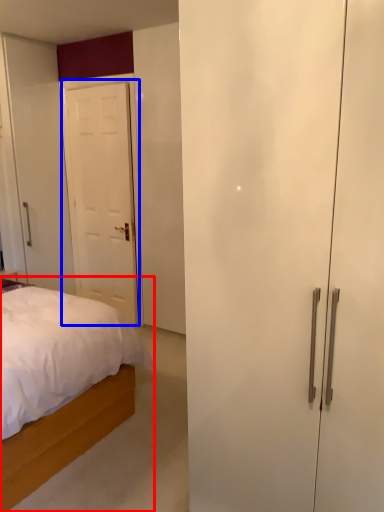
Question: Which object is closer to the camera taking this photo, bed (highlighted by a red box) or door (highlighted by a blue box)?

Choices:
 (A) bed
 (B) door

Answer: (A)